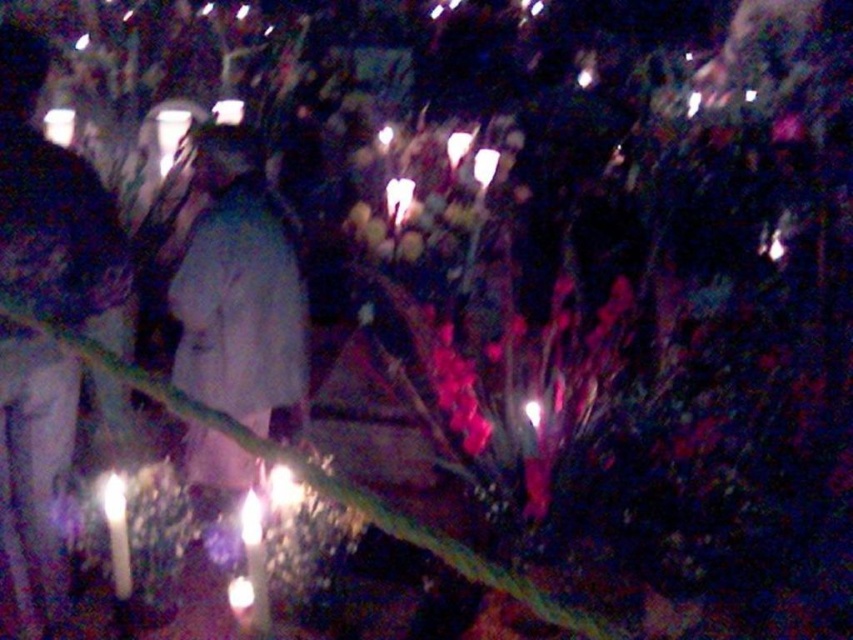
You are at an outdoor event and see the light gray fabric jacket at left and the white paper at center. Which object is closer to your eye level?

The light gray fabric jacket at left is taller than the white paper at center, so it is closer to your eye level.

Based on the photo, you are at an event and want to light both the translucent glass candle at lower center and the white wax candle at lower left. Which candle should you light first if you want the one closer to you to be lit first?

You should light the translucent glass candle at lower center first because it is in front of the white wax candle at lower left, making it closer to you.